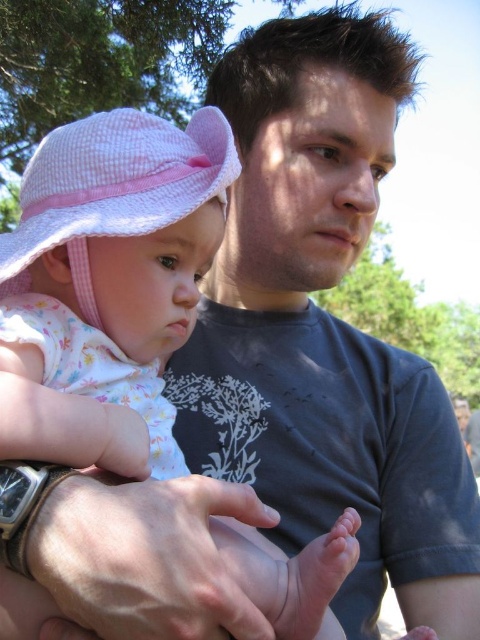
In the scene shown: You are a photographer trying to capture a closeup of the baby in the image. You notice two pink hats in the background. Which hat is closer to the center of the image, the pink gingham hat at upper left or the pink seersucker hat at left?

The pink gingham hat at upper left is positioned on the right side of the pink seersucker hat at left, so the pink seersucker hat at left is closer to the center of the image.

You are a photographer trying to capture a closeup of the baby. You notice two hats in the background. Which hat is lower in the frame between the pink gingham hat at upper left and the pink seersucker hat at left?

The pink gingham hat at upper left is positioned under the pink seersucker hat at left, so it is lower in the frame.